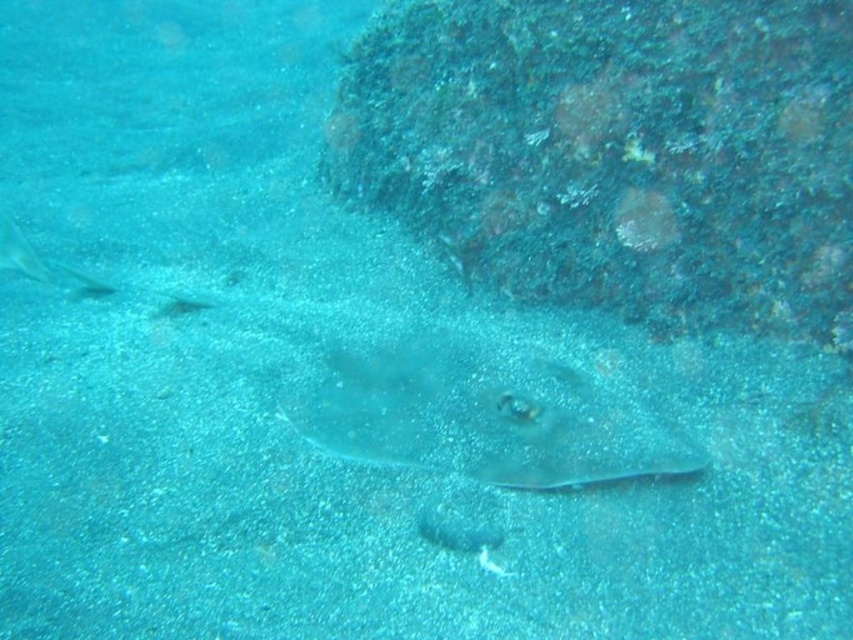
Can you confirm if rough textured rock at upper right is taller than translucent rubber stingray at center?

Yes, rough textured rock at upper right is taller than translucent rubber stingray at center.

The width and height of the screenshot is (853, 640). Find the location of `rough textured rock at upper right`. rough textured rock at upper right is located at coordinates (616, 152).